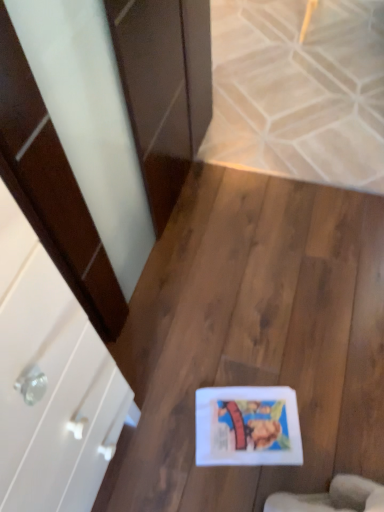
Identify the location of vacant area situated below white glossy cabinet at left (from a real-world perspective). (132, 452).